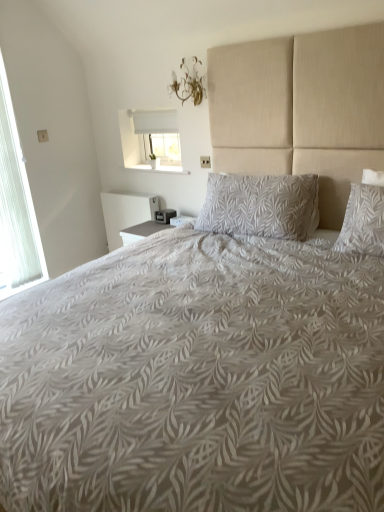
Question: Considering the relative sizes of white fabric window at upper center, placed as the 2th window when sorted from left to right, and gray leaf-patterned pillow at center in the image provided, is white fabric window at upper center, placed as the 2th window when sorted from left to right, taller than gray leaf-patterned pillow at center?

Choices:
 (A) no
 (B) yes

Answer: (A)

Question: From the image's perspective, is white fabric window at upper center, placed as the first window when sorted from right to left, located above gray leaf-patterned pillow at center?

Choices:
 (A) yes
 (B) no

Answer: (A)

Question: Does white fabric window at upper center, placed as the 2th window when sorted from left to right, have a smaller size compared to gray leaf-patterned pillow at center?

Choices:
 (A) yes
 (B) no

Answer: (A)

Question: Considering the relative sizes of white fabric window at upper center, placed as the first window when sorted from right to left, and gray leaf-patterned pillow at center in the image provided, is white fabric window at upper center, placed as the first window when sorted from right to left, thinner than gray leaf-patterned pillow at center?

Choices:
 (A) yes
 (B) no

Answer: (A)

Question: Does white fabric window at upper center, placed as the first window when sorted from right to left, touch gray leaf-patterned pillow at center?

Choices:
 (A) no
 (B) yes

Answer: (A)

Question: Do you think white fabric window at upper center, placed as the first window when sorted from right to left, is within gray leaf-patterned pillow at center, or outside of it?

Choices:
 (A) outside
 (B) inside

Answer: (A)

Question: Considering the positions of white fabric window at upper center, placed as the 2th window when sorted from left to right, and gray leaf-patterned pillow at center in the image, is white fabric window at upper center, placed as the 2th window when sorted from left to right, bigger or smaller than gray leaf-patterned pillow at center?

Choices:
 (A) big
 (B) small

Answer: (B)

Question: In terms of width, does white fabric window at upper center, placed as the 2th window when sorted from left to right, look wider or thinner when compared to gray leaf-patterned pillow at center?

Choices:
 (A) thin
 (B) wide

Answer: (A)

Question: From the image's perspective, is white fabric window at upper center, placed as the 2th window when sorted from left to right, located above or below gray leaf-patterned pillow at center?

Choices:
 (A) below
 (B) above

Answer: (B)

Question: In terms of width, does gold metallic chandelier at upper center look wider or thinner when compared to white sheer curtain at left, which appears as the first window when viewed from the left?

Choices:
 (A) thin
 (B) wide

Answer: (B)

Question: Based on their positions, is gold metallic chandelier at upper center located to the left or right of white sheer curtain at left, which appears as the first window when viewed from the left?

Choices:
 (A) left
 (B) right

Answer: (B)

Question: Choose the correct answer: Is gold metallic chandelier at upper center inside white sheer curtain at left, which appears as the first window when viewed from the left, or outside it?

Choices:
 (A) outside
 (B) inside

Answer: (A)

Question: Considering the positions of gold metallic chandelier at upper center and white sheer curtain at left, which is the 2th window in right-to-left order, in the image, is gold metallic chandelier at upper center taller or shorter than white sheer curtain at left, which is the 2th window in right-to-left order,?

Choices:
 (A) tall
 (B) short

Answer: (B)

Question: From a real-world perspective, is gray leaf-patterned pillow at center above or below white sheer curtain at left, which is the 2th window in right-to-left order?

Choices:
 (A) above
 (B) below

Answer: (B)

Question: Considering the positions of gray leaf-patterned pillow at center and white sheer curtain at left, which appears as the first window when viewed from the left, in the image, is gray leaf-patterned pillow at center wider or thinner than white sheer curtain at left, which appears as the first window when viewed from the left,?

Choices:
 (A) thin
 (B) wide

Answer: (B)